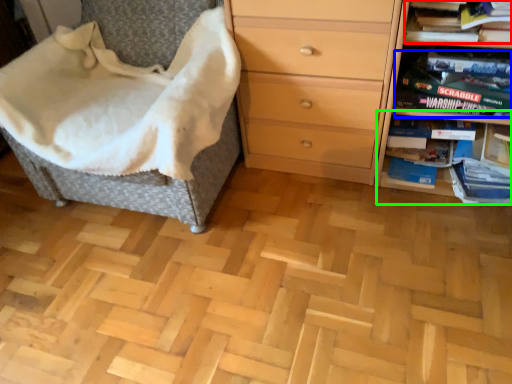
Question: Considering the real-world distances, which object is farthest from book (highlighted by a red box)? paperback book (highlighted by a blue box) or shelf (highlighted by a green box)?

Choices:
 (A) paperback book
 (B) shelf

Answer: (B)